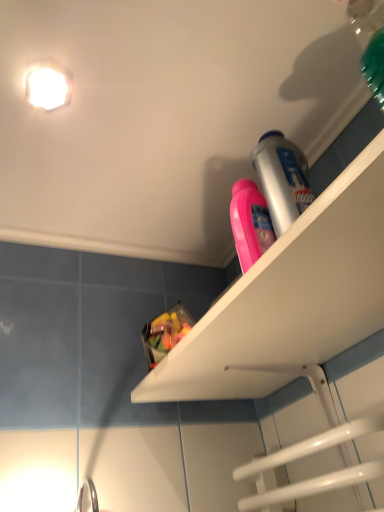
Question: Is white glossy light fixture at upper left wider than white plastic shelf at upper right?

Choices:
 (A) no
 (B) yes

Answer: (A)

Question: Is white glossy light fixture at upper left to the left of white plastic shelf at upper right from the viewer's perspective?

Choices:
 (A) yes
 (B) no

Answer: (A)

Question: Does white glossy light fixture at upper left have a greater height compared to white plastic shelf at upper right?

Choices:
 (A) yes
 (B) no

Answer: (B)

Question: Is white plastic shelf at upper right surrounded by white glossy light fixture at upper left?

Choices:
 (A) yes
 (B) no

Answer: (B)

Question: From a real-world perspective, is white glossy light fixture at upper left positioned over white plastic shelf at upper right based on gravity?

Choices:
 (A) yes
 (B) no

Answer: (A)

Question: From the image's perspective, does white glossy light fixture at upper left appear lower than white plastic shelf at upper right?

Choices:
 (A) no
 (B) yes

Answer: (A)

Question: Can you confirm if white glossy light fixture at upper left is shorter than translucent plastic bag of candy at upper center?

Choices:
 (A) yes
 (B) no

Answer: (A)

Question: From the image's perspective, does white glossy light fixture at upper left appear lower than translucent plastic bag of candy at upper center?

Choices:
 (A) yes
 (B) no

Answer: (B)

Question: Is white glossy light fixture at upper left looking in the opposite direction of translucent plastic bag of candy at upper center?

Choices:
 (A) yes
 (B) no

Answer: (B)

Question: Is the position of white glossy light fixture at upper left less distant than that of translucent plastic bag of candy at upper center?

Choices:
 (A) no
 (B) yes

Answer: (B)

Question: Is white glossy light fixture at upper left beside translucent plastic bag of candy at upper center?

Choices:
 (A) no
 (B) yes

Answer: (A)

Question: Is white glossy light fixture at upper left at the left side of translucent plastic bag of candy at upper center?

Choices:
 (A) yes
 (B) no

Answer: (A)

Question: Is translucent plastic bag of candy at upper center outside of white plastic shelf at upper right?

Choices:
 (A) no
 (B) yes

Answer: (B)